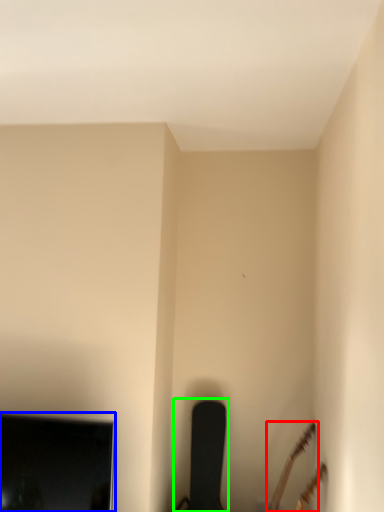
Question: Considering the real-world distances, which object is farthest from guitar (highlighted by a red box)? television (highlighted by a blue box) or chair (highlighted by a green box)?

Choices:
 (A) television
 (B) chair

Answer: (A)